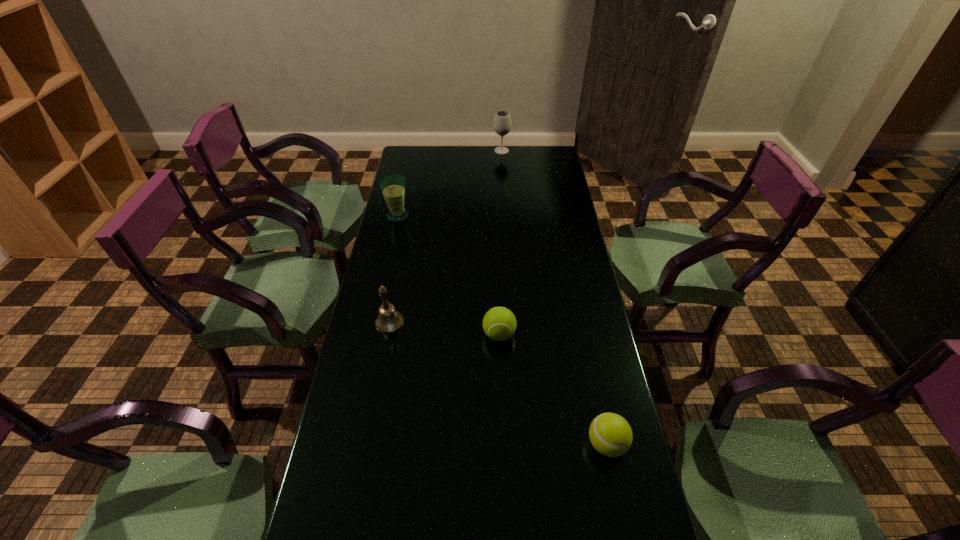
This screenshot has height=540, width=960. I want to click on vacant space located on the right of the left tennis ball, so click(603, 334).

You are a GUI agent. You are given a task and a screenshot of the screen. Output one action in this format:
    pyautogui.click(x=<x>, y=<y>)
    Task: Click on the object at the far edge
    The height and width of the screenshot is (540, 960).
    Given the screenshot: What is the action you would take?
    pyautogui.click(x=502, y=124)

This screenshot has width=960, height=540. Find the location of `glass that is at the left edge`. glass that is at the left edge is located at coordinates (392, 185).

The height and width of the screenshot is (540, 960). Identify the location of bell that is at the left edge. (389, 320).

At what (x,y) coordinates should I click in order to perform the action: click on object that is at the right edge. Please return your answer as a coordinate pair (x, y). This screenshot has height=540, width=960. Looking at the image, I should click on (610, 434).

The width and height of the screenshot is (960, 540). In the image, there is a desktop. What are the coordinates of `vacant space at the far edge` in the screenshot? It's located at (461, 153).

Where is `vacant space at the left edge of the desktop`? The height and width of the screenshot is (540, 960). vacant space at the left edge of the desktop is located at coordinates 382,382.

Identify the location of vacant space at the right edge of the desktop. (580, 288).

The image size is (960, 540). Identify the location of vacant space at the far right corner of the desktop. (546, 159).

Image resolution: width=960 pixels, height=540 pixels. In order to click on empty location between the rightmost object and the farthest object in this screenshot , I will do `click(554, 298)`.